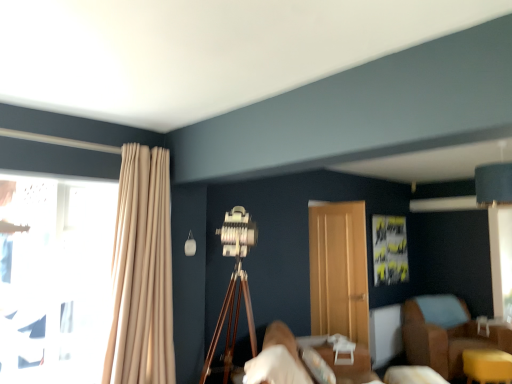
Measure the distance between point (237, 298) and camera.

Point (237, 298) and camera are 3.56 meters apart.

Where is `wooden tripod at center`? The width and height of the screenshot is (512, 384). wooden tripod at center is located at coordinates (231, 324).

Where is `beige fabric curtain at left`? This screenshot has width=512, height=384. beige fabric curtain at left is located at coordinates (142, 272).

Image resolution: width=512 pixels, height=384 pixels. Describe the element at coordinates (142, 272) in the screenshot. I see `beige fabric curtain at left` at that location.

Find the location of `yellow matte table at lower right`. yellow matte table at lower right is located at coordinates (487, 366).

Describe the element at coordinates (487, 366) in the screenshot. Image resolution: width=512 pixels, height=384 pixels. I see `yellow matte table at lower right` at that location.

Find the location of a particular element. transparent glass window at left is located at coordinates (55, 280).

Is wooden tripod at center not near wooden door at center?

That's right, there is a large distance between wooden tripod at center and wooden door at center.

How many degrees apart are the facing directions of wooden tripod at center and wooden door at center?

The angular difference between wooden tripod at center and wooden door at center is 54.5 degrees.

How far apart are wooden tripod at center and wooden door at center?

A distance of 4.51 feet exists between wooden tripod at center and wooden door at center.

In the scene shown: Considering the positions of objects wooden tripod at center and wooden door at center in the image provided, who is more to the right, wooden tripod at center or wooden door at center?

Positioned to the right is wooden door at center.

Identify the location of bed that is on the right side of transparent glass window at left. (277, 360).

Is transparent glass window at left spatially inside white fabric bed at lower center, or outside of it?

transparent glass window at left is not enclosed by white fabric bed at lower center.

From the image's perspective, is transparent glass window at left under white fabric bed at lower center?

Actually, transparent glass window at left appears above white fabric bed at lower center in the image.

From the image's perspective, is beige fabric curtain at left located above or below wooden tripod at center?

Clearly, from the image's perspective, beige fabric curtain at left is above wooden tripod at center.

Considering the sizes of beige fabric curtain at left and wooden tripod at center in the image, is beige fabric curtain at left wider or thinner than wooden tripod at center?

Clearly, beige fabric curtain at left has less width compared to wooden tripod at center.

Is beige fabric curtain at left to the left of wooden tripod at center from the viewer's perspective?

Yes.

Considering the positions of objects beige fabric curtain at left and wooden tripod at center in the image provided, who is in front, beige fabric curtain at left or wooden tripod at center?

Positioned in front is beige fabric curtain at left.

Looking at this image, is beige fabric curtain at left positioned beyond the bounds of white fabric bed at lower center?

Yes.

Can you confirm if beige fabric curtain at left is shorter than white fabric bed at lower center?

Incorrect, the height of beige fabric curtain at left does not fall short of that of white fabric bed at lower center.

From the image's perspective, between beige fabric curtain at left and white fabric bed at lower center, which one is located above?

beige fabric curtain at left is shown above in the image.

Image resolution: width=512 pixels, height=384 pixels. I want to click on curtain above the white fabric bed at lower center (from a real-world perspective), so click(142, 272).

Does wooden door at center have a greater width compared to transparent glass window at left?

Yes, wooden door at center is wider than transparent glass window at left.

Is wooden door at center positioned with its back to transparent glass window at left?

Correct, wooden door at center is looking away from transparent glass window at left.

Between wooden door at center and transparent glass window at left, which one has smaller size?

transparent glass window at left is smaller.

In terms of height, does wooden door at center look taller or shorter compared to transparent glass window at left?

Clearly, wooden door at center is taller compared to transparent glass window at left.

Is wooden door at center facing towards beige fabric curtain at left?

No, wooden door at center is not facing towards beige fabric curtain at left.

I want to click on screen door on the right of beige fabric curtain at left, so click(x=339, y=270).

From the image's perspective, would you say wooden door at center is positioned over beige fabric curtain at left?

No.

Between wooden door at center and beige fabric curtain at left, which one has larger width?

With larger width is beige fabric curtain at left.

Does yellow matte table at lower right lie behind beige fabric curtain at left?

Yes, yellow matte table at lower right is further from the camera.

Are yellow matte table at lower right and beige fabric curtain at left far apart?

Yes, yellow matte table at lower right is far from beige fabric curtain at left.

Which of these two, yellow matte table at lower right or beige fabric curtain at left, is wider?

yellow matte table at lower right.

Does point (494, 353) lie behind point (131, 364)?

Yes, it is.

You are a GUI agent. You are given a task and a screenshot of the screen. Output one action in this format:
    pyautogui.click(x=<x>, y=<y>)
    Task: Click on the screen door behind the wooden tripod at center
    This screenshot has height=384, width=512.
    Given the screenshot: What is the action you would take?
    pyautogui.click(x=339, y=270)

Identify the location of window above the white fabric bed at lower center (from a real-world perspective). The height and width of the screenshot is (384, 512). (55, 280).

From the picture: Considering their positions, is yellow matte table at lower right positioned further to wooden tripod at center than brown leather armchair at lower right?

Among the two, brown leather armchair at lower right is located further to wooden tripod at center.

Based on their spatial positions, is wooden tripod at center or brown leather armchair at lower right further from wooden door at center?

brown leather armchair at lower right.

Estimate the real-world distances between objects in this image. Which object is closer to beige fabric curtain at left, wooden tripod at center or wooden door at center?

The object closer to beige fabric curtain at left is wooden tripod at center.

Which object lies further to the anchor point beige fabric curtain at left, transparent glass window at left or white fabric bed at lower center?

white fabric bed at lower center lies further to beige fabric curtain at left than the other object.

Which object lies further to the anchor point brown leather armchair at lower right, wooden tripod at center or yellow matte table at lower right?

wooden tripod at center is further to brown leather armchair at lower right.

Looking at the image, which one is located closer to wooden door at center, beige fabric curtain at left or white fabric bed at lower center?

white fabric bed at lower center.

Considering their positions, is beige fabric curtain at left positioned further to brown leather armchair at lower right than wooden tripod at center?

Among the two, beige fabric curtain at left is located further to brown leather armchair at lower right.

Estimate the real-world distances between objects in this image. Which object is closer to yellow matte table at lower right, brown leather armchair at lower right or wooden tripod at center?

brown leather armchair at lower right lies closer to yellow matte table at lower right than the other object.

The image size is (512, 384). I want to click on tripod between transparent glass window at left and white fabric bed at lower center, so click(x=231, y=324).

Locate an element on the screen. The width and height of the screenshot is (512, 384). bed between wooden tripod at center and yellow matte table at lower right in the horizontal direction is located at coordinates (277, 360).

Image resolution: width=512 pixels, height=384 pixels. I want to click on screen door between transparent glass window at left and yellow matte table at lower right, so click(339, 270).

Locate an element on the screen. table located between white fabric bed at lower center and brown leather armchair at lower right in the depth direction is located at coordinates (487, 366).